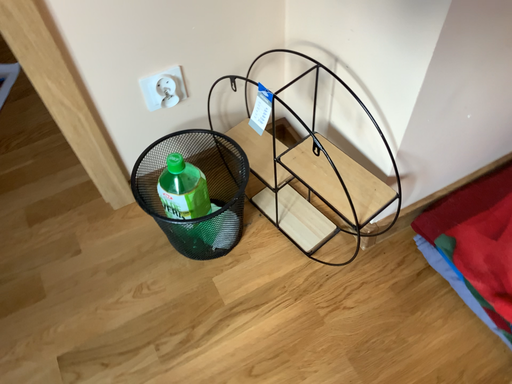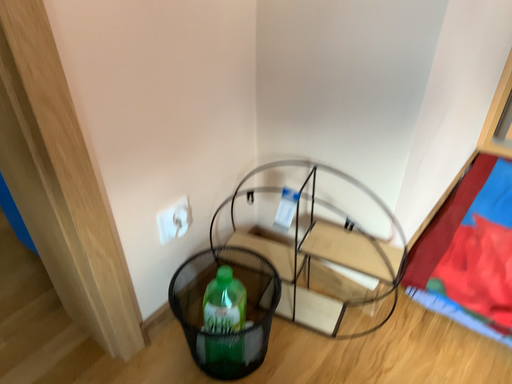
Question: Which way did the camera rotate in the video?

Choices:
 (A) rotated downward
 (B) rotated upward

Answer: (B)